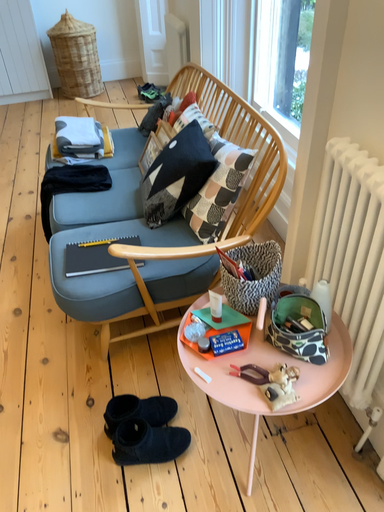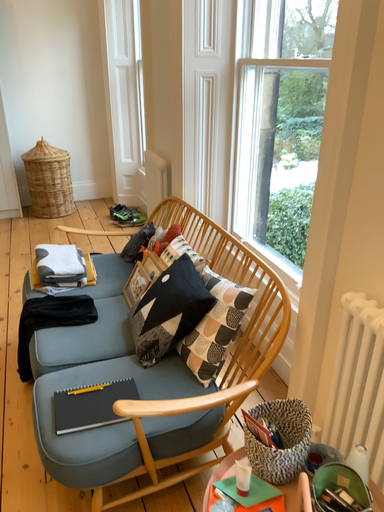
Question: How did the camera likely rotate when shooting the video?

Choices:
 (A) rotated right
 (B) rotated left

Answer: (A)